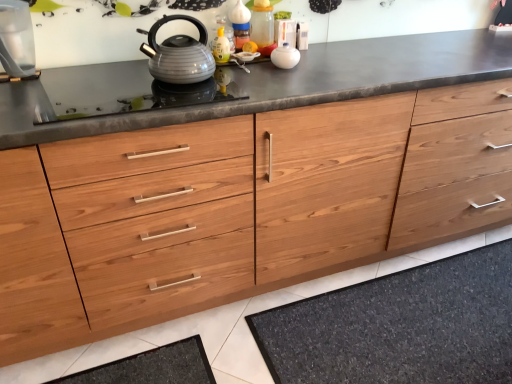
Question: Considering the relative sizes of matte gray kettle at center and black glass gas stove at center in the image provided, is matte gray kettle at center taller than black glass gas stove at center?

Choices:
 (A) no
 (B) yes

Answer: (B)

Question: Is matte gray kettle at center positioned before black glass gas stove at center?

Choices:
 (A) yes
 (B) no

Answer: (B)

Question: Is matte gray kettle at center smaller than black glass gas stove at center?

Choices:
 (A) yes
 (B) no

Answer: (B)

Question: Is matte gray kettle at center to the right of black glass gas stove at center from the viewer's perspective?

Choices:
 (A) no
 (B) yes

Answer: (B)

Question: From the image's perspective, is matte gray kettle at center beneath black glass gas stove at center?

Choices:
 (A) no
 (B) yes

Answer: (A)

Question: Looking at their shapes, would you say black glass gas stove at center is wider or thinner than matte gray kettle at center?

Choices:
 (A) wide
 (B) thin

Answer: (A)

Question: Is black glass gas stove at center taller or shorter than matte gray kettle at center?

Choices:
 (A) tall
 (B) short

Answer: (B)

Question: Considering the positions of point (151, 82) and point (169, 39), is point (151, 82) closer or farther from the camera than point (169, 39)?

Choices:
 (A) closer
 (B) farther

Answer: (B)

Question: Visually, is black glass gas stove at center positioned to the left or to the right of matte gray kettle at center?

Choices:
 (A) right
 (B) left

Answer: (B)

Question: Visually, is white glossy bowl at upper center, the second appliance in the left-to-right sequence, positioned to the left or to the right of transparent glass water at left, the second appliance in the right-to-left sequence?

Choices:
 (A) right
 (B) left

Answer: (A)

Question: From the image's perspective, is white glossy bowl at upper center, the second appliance in the left-to-right sequence, located above or below transparent glass water at left, the second appliance in the right-to-left sequence?

Choices:
 (A) above
 (B) below

Answer: (A)

Question: From their relative heights in the image, would you say white glossy bowl at upper center, the second appliance in the left-to-right sequence, is taller or shorter than transparent glass water at left, the first appliance positioned from the left?

Choices:
 (A) tall
 (B) short

Answer: (B)

Question: Is white glossy bowl at upper center, the second appliance in the left-to-right sequence, in front of or behind transparent glass water at left, the first appliance positioned from the left, in the image?

Choices:
 (A) front
 (B) behind

Answer: (B)

Question: Is point (96, 97) closer or farther from the camera than point (482, 352)?

Choices:
 (A) closer
 (B) farther

Answer: (B)

Question: In terms of height, does black glass gas stove at center look taller or shorter compared to dark gray textured bath mat at lower center?

Choices:
 (A) short
 (B) tall

Answer: (A)